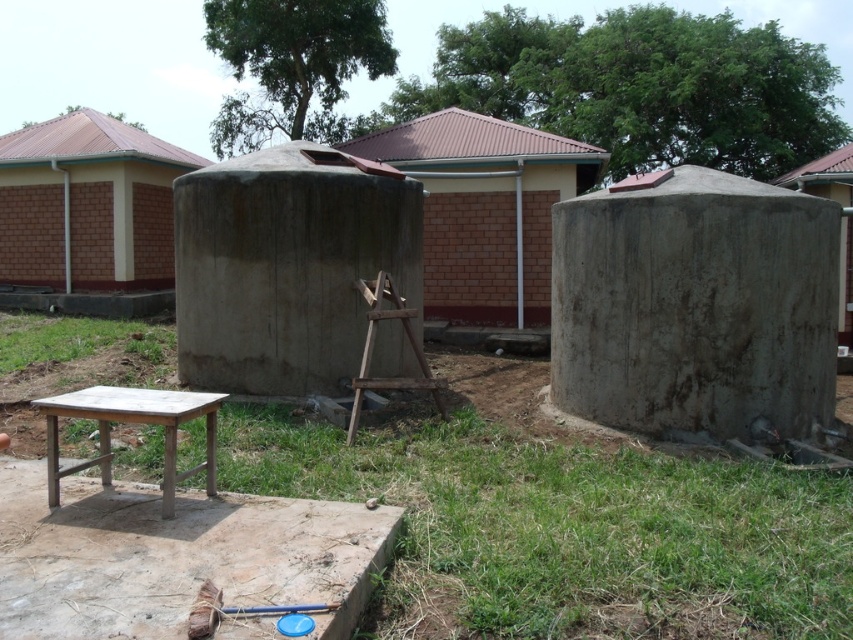
You are a painter who wants to set up your canvas between the brown brick wall at left and the concrete hut at center. Based on the scene, can you position it there without it being blocked from view?

The concrete hut at center is behind the brown brick wall at left, so placing the canvas between them would mean it is in front of both. This should keep the canvas visible and unobstructed.

You are setting up a picnic and have a large blanket that is 2 meters wide. You want to place it under the wooden table at lower left and the gray concrete tank at center. Will the blanket be wide enough to cover both objects?

The wooden table at lower left has a lesser width compared to gray concrete tank at center. Since the blanket is 2 meters wide, it depends on the combined width of both objects. However, the description only states the table is narrower than the tank, but not their exact widths. Without knowing the tank or table dimensions, we cannot confirm if the blanket will cover both.

Consider the image. You are standing at the edge of the grassy area and want to place a new bench between the wooden table at lower left and the gray concrete tank at center. Based on their positions, which object should the bench be closer to?

The bench should be closer to the wooden table at lower left because it is in front of the gray concrete tank at center, so the distance between the bench and the table would be shorter than the distance between the bench and the tank if placed centrally.